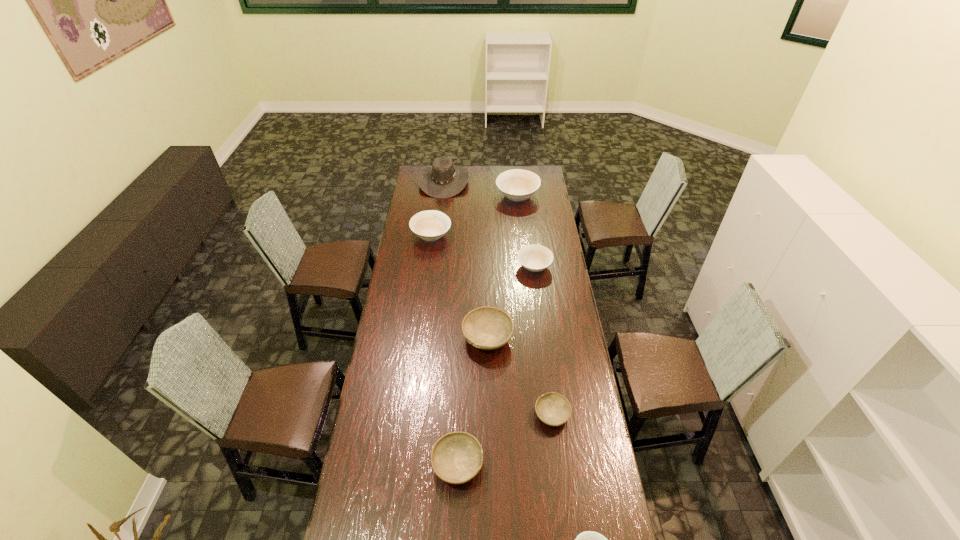
The height and width of the screenshot is (540, 960). Find the location of `the tallest object`. the tallest object is located at coordinates (443, 179).

Where is `the farthest bowl`? The height and width of the screenshot is (540, 960). the farthest bowl is located at coordinates (518, 185).

Where is `the seventh shortest object`? the seventh shortest object is located at coordinates point(518,185).

The width and height of the screenshot is (960, 540). What are the coordinates of `the second biggest beige bowl` in the screenshot? It's located at (x=430, y=225).

This screenshot has width=960, height=540. What are the coordinates of `the leftmost beige bowl` in the screenshot? It's located at (430, 225).

Locate an element on the screen. the farthest gray bowl is located at coordinates (488, 328).

At what (x,y) coordinates should I click in order to perform the action: click on the fourth nearest object. Please return your answer as a coordinate pair (x, y). The width and height of the screenshot is (960, 540). Looking at the image, I should click on (488, 328).

Find the location of `the fifth nearest object`. the fifth nearest object is located at coordinates [x=535, y=258].

Where is `the fifth nearest bowl`? the fifth nearest bowl is located at coordinates point(535,258).

Identify the location of the second nearest object. (456, 458).